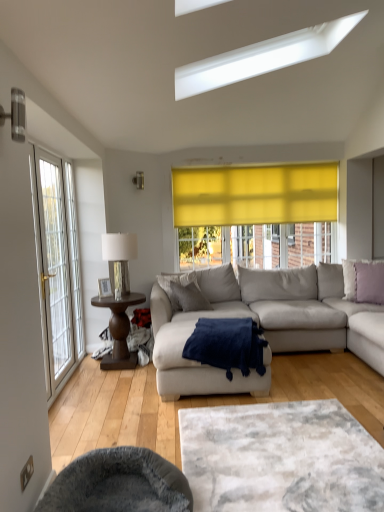
Question: Are lavender fabric pillow at right, which is the first pillow from right to left, and white textured rug at center far apart?

Choices:
 (A) yes
 (B) no

Answer: (A)

Question: Is lavender fabric pillow at right, which is the first pillow from right to left, not within white textured rug at center?

Choices:
 (A) yes
 (B) no

Answer: (A)

Question: Is white textured rug at center a part of lavender fabric pillow at right, the second pillow in the left-to-right sequence?

Choices:
 (A) no
 (B) yes

Answer: (A)

Question: From the image's perspective, is lavender fabric pillow at right, which is the first pillow from right to left, under white textured rug at center?

Choices:
 (A) no
 (B) yes

Answer: (A)

Question: Is lavender fabric pillow at right, which is the first pillow from right to left, placed right next to white textured rug at center?

Choices:
 (A) yes
 (B) no

Answer: (B)

Question: Is lavender fabric pillow at right, the second pillow in the left-to-right sequence, smaller than white textured rug at center?

Choices:
 (A) yes
 (B) no

Answer: (A)

Question: Is lavender fabric pillow at right, the second pillow in the left-to-right sequence, surrounded by metallic silver lamp at upper center?

Choices:
 (A) no
 (B) yes

Answer: (A)

Question: From the image's perspective, would you say metallic silver lamp at upper center is shown under lavender fabric pillow at right, which is the first pillow from right to left?

Choices:
 (A) no
 (B) yes

Answer: (A)

Question: Are metallic silver lamp at upper center and lavender fabric pillow at right, the second pillow in the left-to-right sequence, making contact?

Choices:
 (A) no
 (B) yes

Answer: (A)

Question: Is metallic silver lamp at upper center further to the viewer compared to lavender fabric pillow at right, the second pillow in the left-to-right sequence?

Choices:
 (A) yes
 (B) no

Answer: (A)

Question: From a real-world perspective, is metallic silver lamp at upper center physically above lavender fabric pillow at right, which is the first pillow from right to left?

Choices:
 (A) no
 (B) yes

Answer: (B)

Question: Is metallic silver lamp at upper center aimed at lavender fabric pillow at right, the second pillow in the left-to-right sequence?

Choices:
 (A) yes
 (B) no

Answer: (B)

Question: Is there a large distance between white textured rug at center and white glass door at left?

Choices:
 (A) yes
 (B) no

Answer: (A)